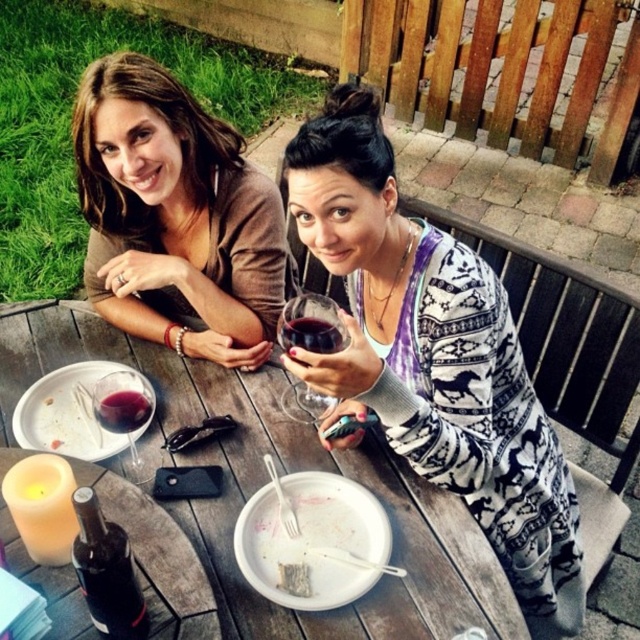
You are a photographer taking a picture of the two women at the outdoor table. You want to focus on the white printed sweater at center and the transparent glass wine glass at center. Which object is positioned to the right of the other?

The white printed sweater at center is to the right of the transparent glass wine glass at center.

You are a waiter at a restaurant and need to place a 15 inch long platter between the transparent glass at table center and the white crumbly bread at lower center. Will there be enough space for the platter?

The distance between the transparent glass at table center and the white crumbly bread at lower center is 17.26 inches. Since the platter is 15 inches long, there is enough space to place it between them.